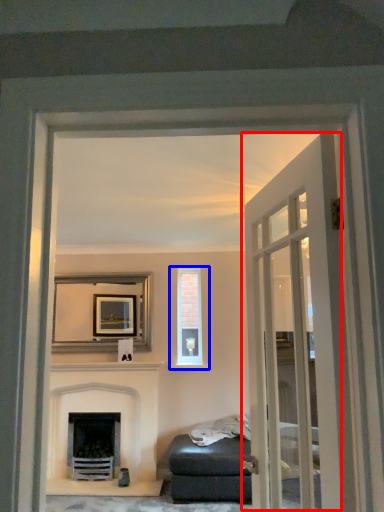
Question: Which of the following is the closest to the observer, door (highlighted by a red box) or window (highlighted by a blue box)?

Choices:
 (A) door
 (B) window

Answer: (A)